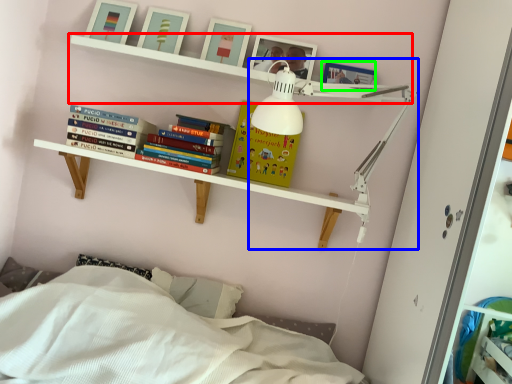
Question: Which is nearer to the shelf (highlighted by a red box)? lamp (highlighted by a blue box) or picture frame (highlighted by a green box).

Choices:
 (A) lamp
 (B) picture frame

Answer: (A)